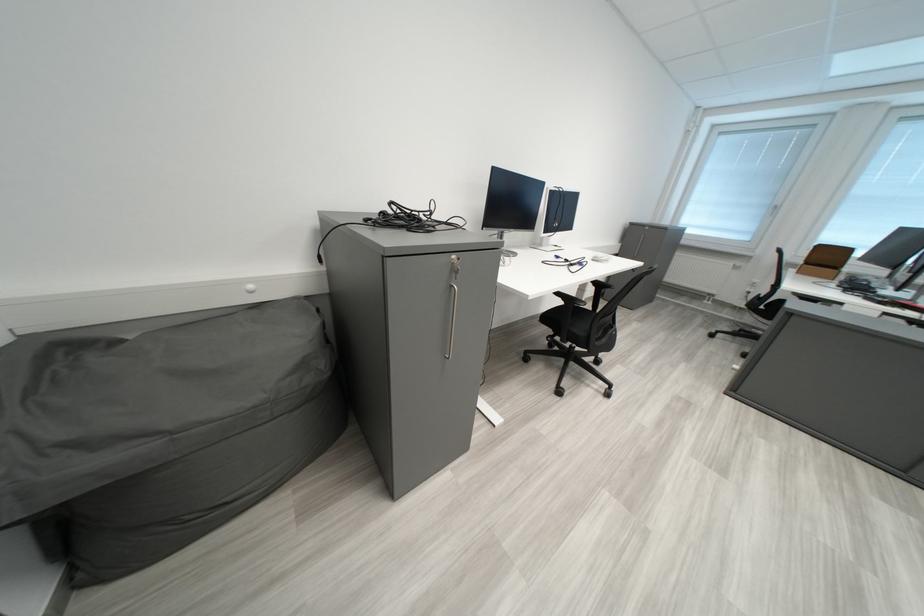
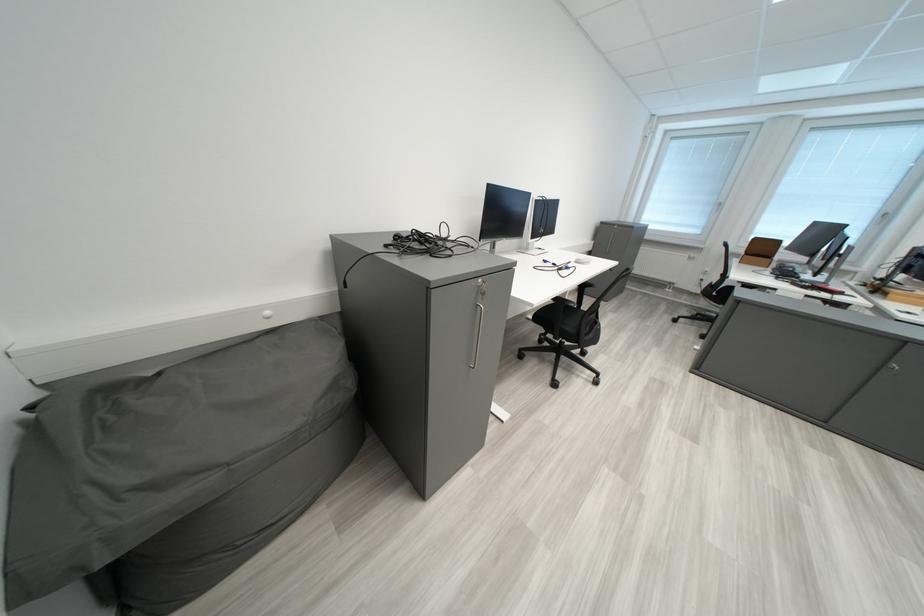
Question: I am providing you with two images of the same scene from different viewpoints. After the viewpoint changes to image2, which objects are now occluded?

Choices:
 (A) silver cabinet handle
 (B) chair armrest
 (C) black lamp arm
 (D) chair sitting surface

Answer: (B)